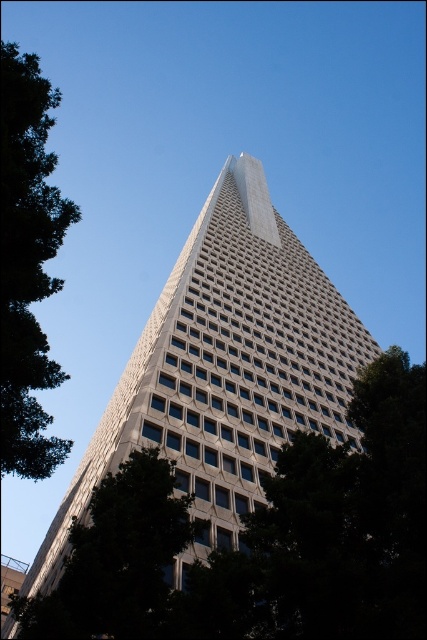
You are standing in front of the skyscraper and notice two green leafy trees in the scene. Which tree, the green leafy tree at left or the green leafy tree at lower left, appears smaller in the image?

The green leafy tree at left appears smaller than the green leafy tree at lower left in the image.

You are standing on the ground floor of the white glass building at center and want to look out the window to see the green leafy tree at left. Is the tree visible from your current position?

The white glass building at center is above the green leafy tree at left, so from the ground floor window of the white glass building at center, the green leafy tree at left would be visible since it is positioned below the building.

You are standing at the base of the skyscraper and looking up. There are two points marked on the building. One is at coordinates point (224,358) and the other at point (139,596). Which point is closer to your line of sight when you look straight ahead?

Point (139,596) is closer to your line of sight because it is in front of point (224,358).